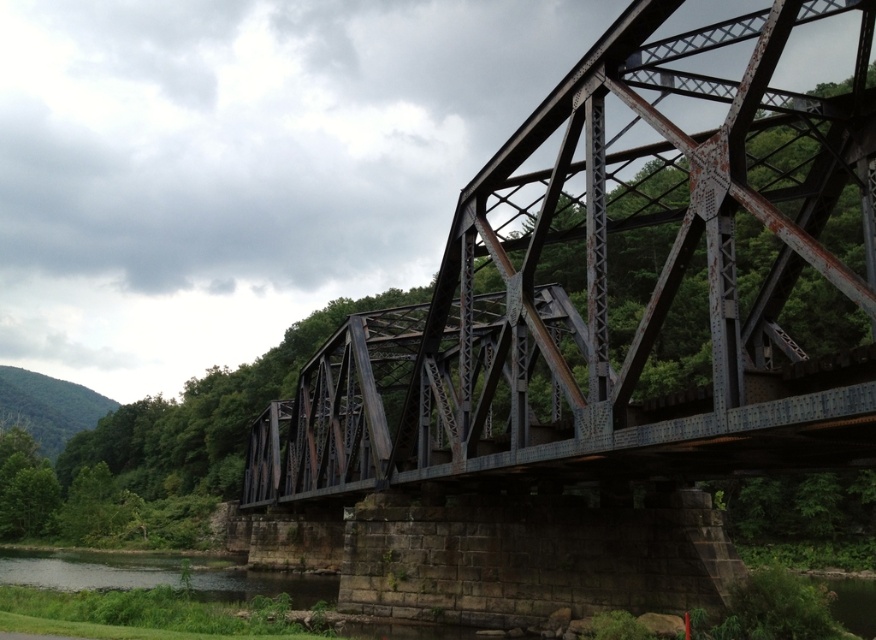
You are a photographer wanting to capture the rusty metal bridge at center and the dark gray water at lower left in the same frame. Considering their heights, which object should you position closer to the top of your camera viewfinder?

The rusty metal bridge at center should be positioned closer to the top of the camera viewfinder because it has a greater height compared to the dark gray water at lower left.

You are a construction inspector tasked with assessing the safety of the rusty metal bridge at center. You notice that the dark gray water at lower left has risen due to recent rain. If the water level continues to rise by 20 feet, will it reach the bridge?

The distance between the rusty metal bridge at center and the dark gray water at lower left is 117.57 feet. Even if the water rises by 20 feet, it would still be 97.57 feet below the bridge, so it won

You are a surveyor tasked with assessing the structural integrity of the rusty metal bridge at center. Based on the coordinates provided in the image description, can you determine if the bridge is positioned centrally over the river?

The rusty metal bridge at center is located at point coordinates (627, 278), which indicates it is positioned centrally over the river as per the given coordinates.